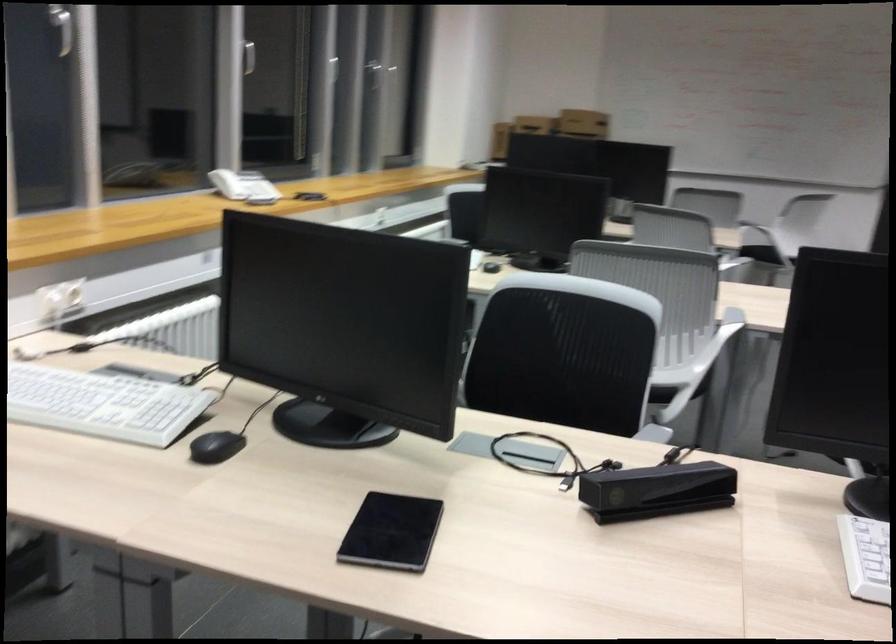
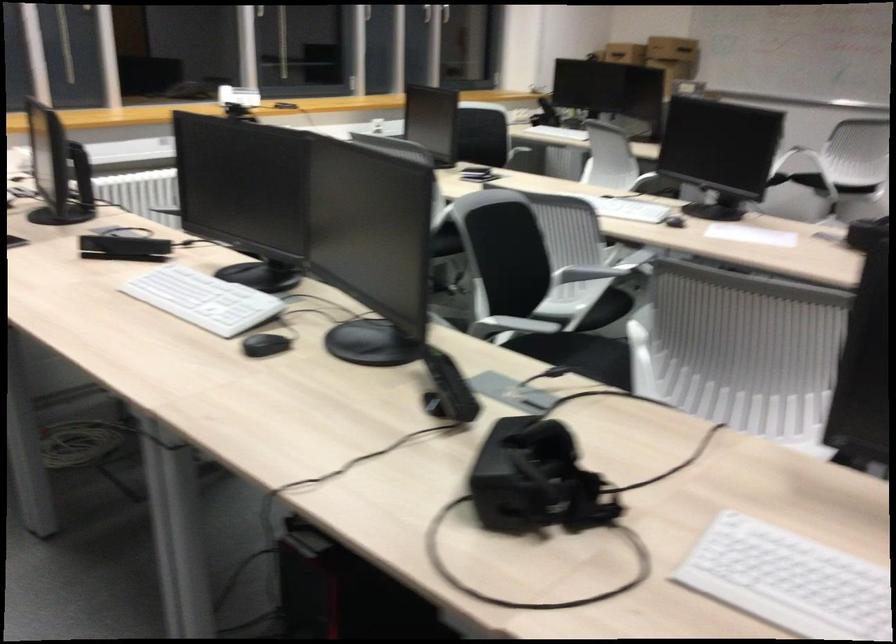
Where in the second image is the point corresponding to (x=226, y=180) from the first image?

(238, 96)